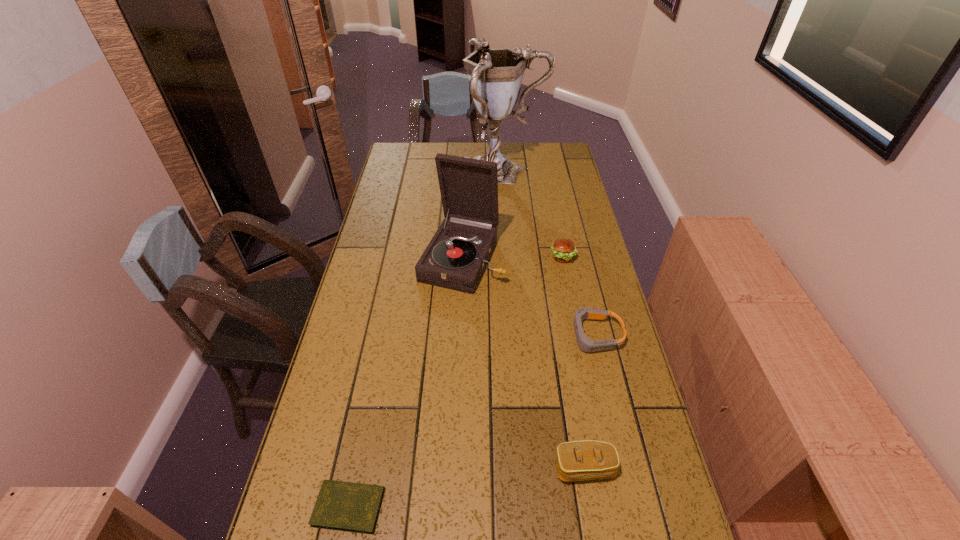
You are a GUI agent. You are given a task and a screenshot of the screen. Output one action in this format:
    pyautogui.click(x=<x>, y=<y>)
    Task: Click on the trophy cup
    
    Given the screenshot: What is the action you would take?
    pyautogui.click(x=495, y=75)

You are a GUI agent. You are given a task and a screenshot of the screen. Output one action in this format:
    pyautogui.click(x=<x>, y=<y>)
    Task: Click on the tallest object
    The width and height of the screenshot is (960, 540).
    Given the screenshot: What is the action you would take?
    pyautogui.click(x=495, y=75)

The width and height of the screenshot is (960, 540). I want to click on phonograph record, so click(456, 257).

Where is `hamburger`? The height and width of the screenshot is (540, 960). hamburger is located at coordinates (563, 250).

Where is `clutch bag`? clutch bag is located at coordinates (578, 460).

I want to click on goggles, so tap(585, 344).

Locate an element on the screen. The width and height of the screenshot is (960, 540). the fourth farthest object is located at coordinates (x=585, y=344).

Find the location of a particular element. The height and width of the screenshot is (540, 960). the leftmost object is located at coordinates (345, 506).

The image size is (960, 540). Find the location of `the shortest object`. the shortest object is located at coordinates (345, 506).

Where is `vacant space located 0.130m on the front of the tallest object`? The height and width of the screenshot is (540, 960). vacant space located 0.130m on the front of the tallest object is located at coordinates (506, 215).